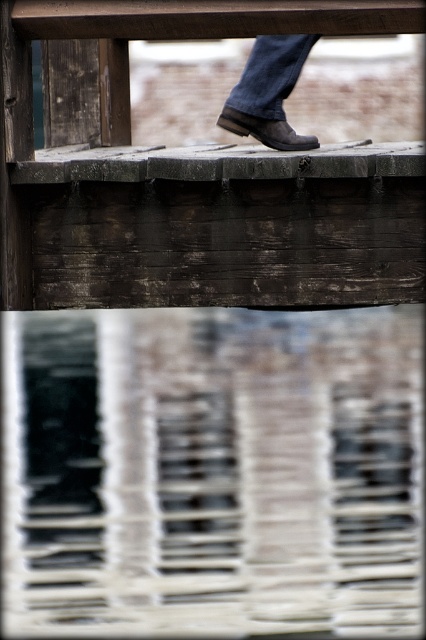
Question: Which of the following is the closest to the observer?

Choices:
 (A) click(252, 54)
 (B) click(357, 380)
 (C) click(253, 118)

Answer: (B)

Question: Which point is closer to the camera?

Choices:
 (A) brown leather boot at center
 (B) translucent glass water at center
 (C) denim at center

Answer: (B)

Question: Can you confirm if translucent glass water at center is bigger than brown leather boot at center?

Choices:
 (A) yes
 (B) no

Answer: (A)

Question: From the image, what is the correct spatial relationship of translucent glass water at center in relation to denim at center?

Choices:
 (A) left
 (B) right

Answer: (A)

Question: Estimate the real-world distances between objects in this image. Which object is closer to the translucent glass water at center?

Choices:
 (A) brown leather boot at center
 (B) denim at center

Answer: (B)

Question: Does translucent glass water at center appear on the left side of denim at center?

Choices:
 (A) no
 (B) yes

Answer: (B)